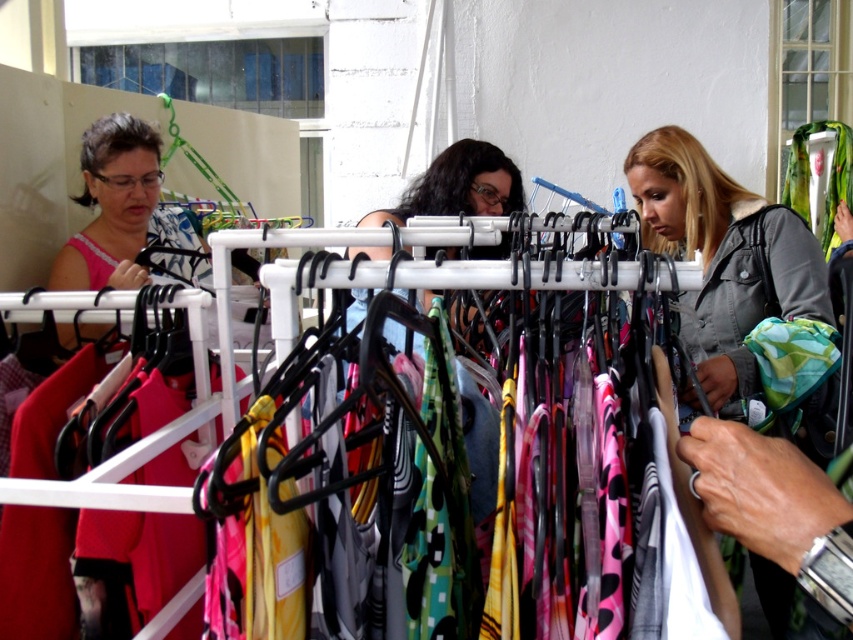
Question: Which of these objects is positioned farthest from the gray denim jacket at center?

Choices:
 (A) green and white patterned fabric at right
 (B) matte black dress at center

Answer: (B)

Question: Can you confirm if green and white patterned fabric at right is positioned below matte black dress at center?

Choices:
 (A) yes
 (B) no

Answer: (A)

Question: Among these points, which one is nearest to the camera?

Choices:
 (A) (492, 200)
 (B) (718, 342)
 (C) (821, 296)

Answer: (C)

Question: Is gray denim jacket at center above matte black dress at center?

Choices:
 (A) yes
 (B) no

Answer: (B)

Question: Among these objects, which one is nearest to the camera?

Choices:
 (A) green and white patterned fabric at right
 (B) matte black dress at center

Answer: (A)

Question: Does gray denim jacket at center appear on the right side of green and white patterned fabric at right?

Choices:
 (A) no
 (B) yes

Answer: (B)